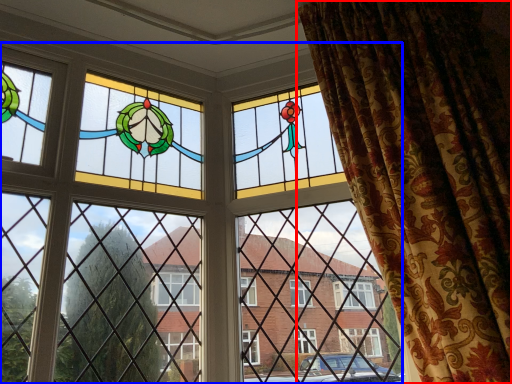
Question: Among these objects, which one is nearest to the camera, curtain (highlighted by a red box) or window (highlighted by a blue box)?

Choices:
 (A) curtain
 (B) window

Answer: (A)